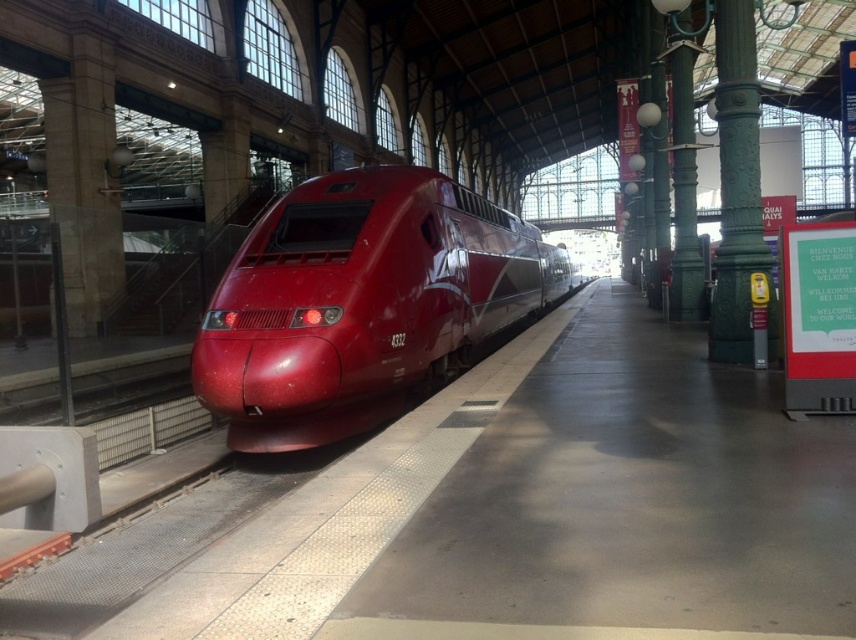
Question: Among these objects, which one is nearest to the camera?

Choices:
 (A) green polished metal pillar at right
 (B) glossy red bullet train at center

Answer: (B)

Question: Is glossy red bullet train at center positioned in front of green polished metal pillar at right?

Choices:
 (A) no
 (B) yes

Answer: (B)

Question: Can you confirm if glossy red bullet train at center is bigger than green polished metal pillar at right?

Choices:
 (A) yes
 (B) no

Answer: (A)

Question: Which of the following is the closest to the observer?

Choices:
 (A) glossy red bullet train at center
 (B) green polished metal pillar at right

Answer: (A)

Question: Does glossy red bullet train at center come behind green polished metal pillar at right?

Choices:
 (A) yes
 (B) no

Answer: (B)

Question: Among these objects, which one is nearest to the camera?

Choices:
 (A) glossy red bullet train at center
 (B) green polished metal pillar at right

Answer: (A)